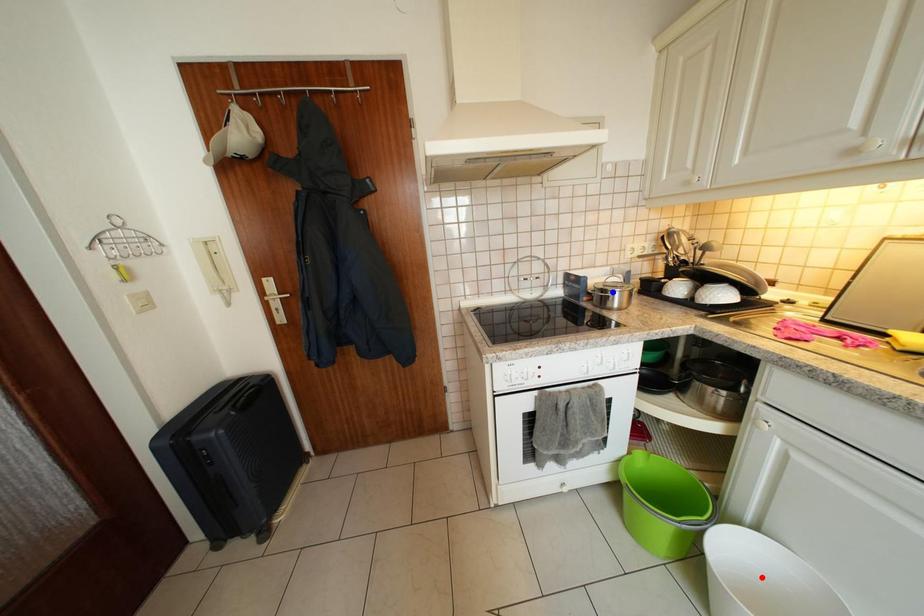
Question: Two points are marked on the image. Which point is closer to the camera?

Choices:
 (A) Blue point is closer.
 (B) Red point is closer.

Answer: (B)